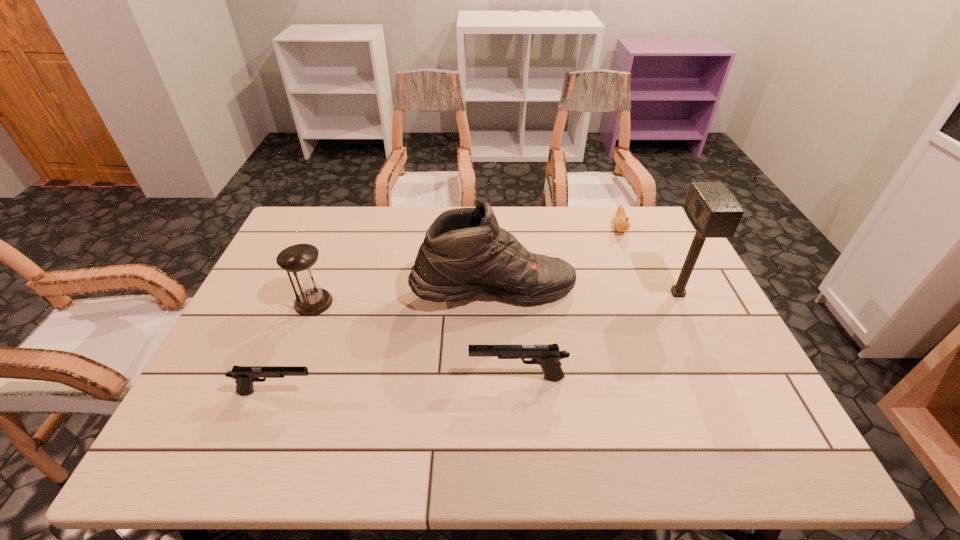
With all guns evenly spaced, where should an extra gun be placed on the right to continue the pattern? Please point out a vacant space. Please provide its 2D coordinates. Your answer should be formatted as a tuple, i.e. [(x, y)], where the tuple contains the x and y coordinates of a point satisfying the conditions above.

[(745, 363)]